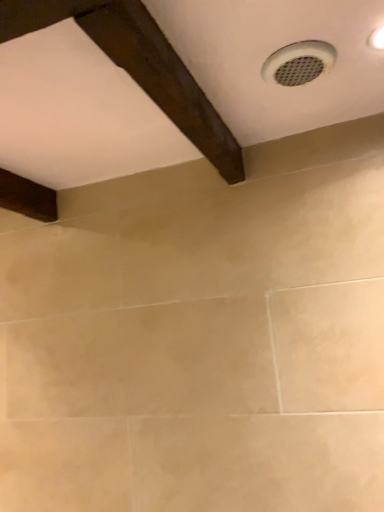
Question: Can you confirm if dark brown wood at upper left is positioned to the right of white plastic vent at upper right?

Choices:
 (A) yes
 (B) no

Answer: (B)

Question: Is dark brown wood at upper left aimed at white plastic vent at upper right?

Choices:
 (A) no
 (B) yes

Answer: (A)

Question: Can you confirm if dark brown wood at upper left is shorter than white plastic vent at upper right?

Choices:
 (A) yes
 (B) no

Answer: (B)

Question: From a real-world perspective, does dark brown wood at upper left sit lower than white plastic vent at upper right?

Choices:
 (A) yes
 (B) no

Answer: (A)

Question: Is dark brown wood at upper left not inside white plastic vent at upper right?

Choices:
 (A) no
 (B) yes

Answer: (B)

Question: Is dark brown wood at upper left facing away from white plastic vent at upper right?

Choices:
 (A) yes
 (B) no

Answer: (B)

Question: Is white plastic vent at upper right located outside dark brown wood at upper left?

Choices:
 (A) yes
 (B) no

Answer: (A)

Question: Considering the relative sizes of white plastic vent at upper right and dark brown wood at upper left in the image provided, is white plastic vent at upper right bigger than dark brown wood at upper left?

Choices:
 (A) no
 (B) yes

Answer: (A)

Question: Considering the relative sizes of white plastic vent at upper right and dark brown wood at upper left in the image provided, is white plastic vent at upper right wider than dark brown wood at upper left?

Choices:
 (A) yes
 (B) no

Answer: (B)

Question: From the image's perspective, is white plastic vent at upper right located beneath dark brown wood at upper left?

Choices:
 (A) no
 (B) yes

Answer: (A)

Question: Is white plastic vent at upper right thinner than dark brown wood at upper left?

Choices:
 (A) yes
 (B) no

Answer: (A)

Question: Is white plastic vent at upper right surrounding dark brown wood at upper left?

Choices:
 (A) yes
 (B) no

Answer: (B)

Question: In terms of height, does dark brown wood at upper left look taller or shorter compared to white plastic vent at upper right?

Choices:
 (A) short
 (B) tall

Answer: (B)